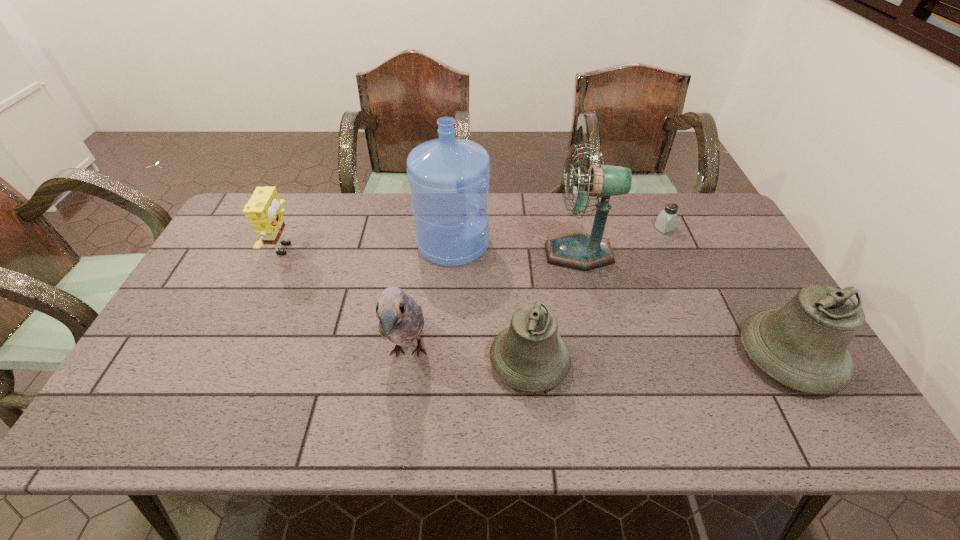
Identify the location of the left bell. The width and height of the screenshot is (960, 540). [x=529, y=355].

Where is `the taller bell`? This screenshot has width=960, height=540. the taller bell is located at coordinates point(803,345).

The width and height of the screenshot is (960, 540). I want to click on the rightmost object, so click(x=803, y=345).

Where is `the shortest object`? This screenshot has width=960, height=540. the shortest object is located at coordinates (666, 221).

The height and width of the screenshot is (540, 960). I want to click on the sixth object from left to right, so click(666, 221).

Where is `water jug`? water jug is located at coordinates (449, 178).

You are a GUI agent. You are given a task and a screenshot of the screen. Output one action in this format:
    pyautogui.click(x=<x>, y=<y>)
    Task: Click on the leftmost object
    The height and width of the screenshot is (540, 960).
    Given the screenshot: What is the action you would take?
    pyautogui.click(x=263, y=210)

The width and height of the screenshot is (960, 540). I want to click on fan, so click(x=579, y=251).

Identify the location of parrot. (401, 320).

Identify the location of vacant area situated on the right of the shorter bell. (722, 361).